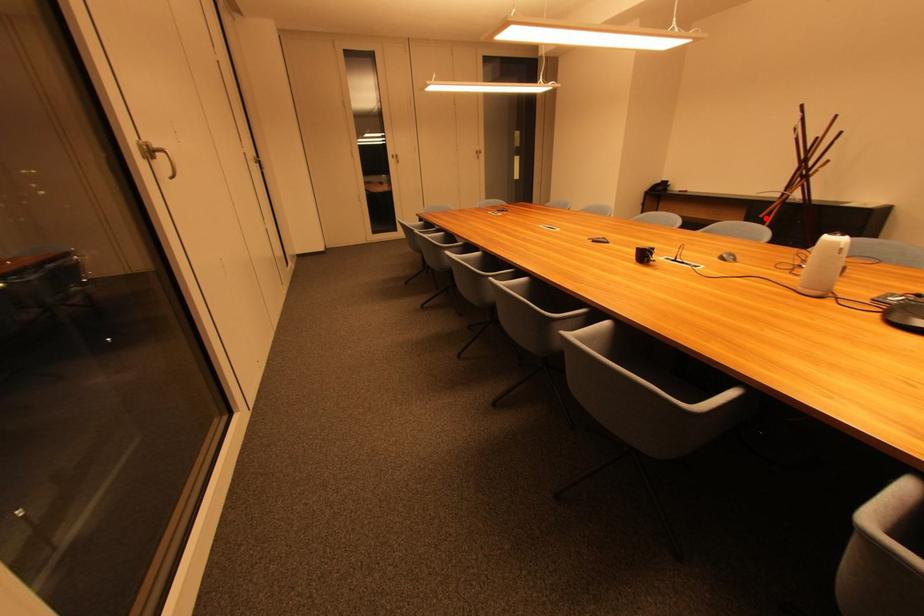
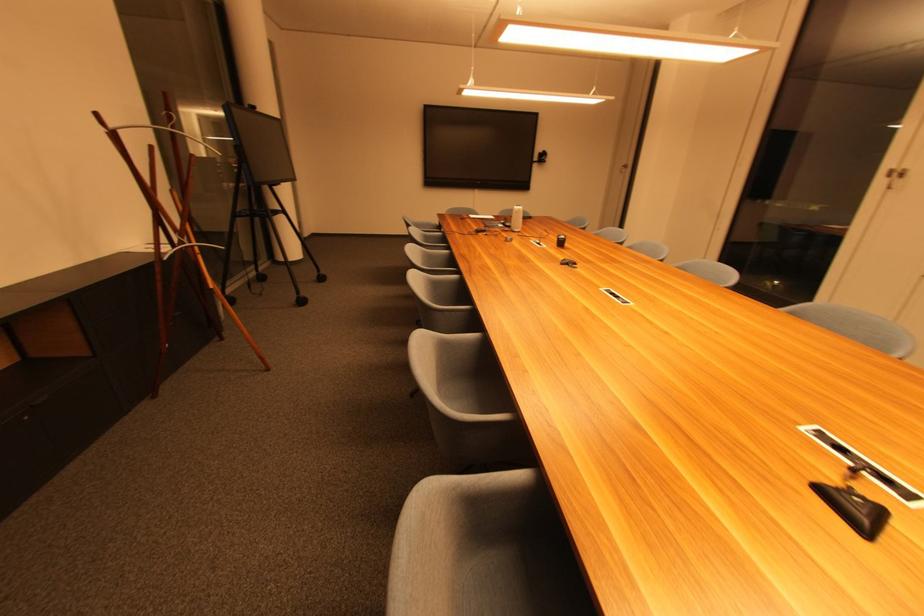
Question: A red point is marked in image1. In image2, is the corresponding 3D point closer to the camera or farther? Reply with the corresponding letter.

Choices:
 (A) The corresponding 3D point is closer.
 (B) The corresponding 3D point is farther.

Answer: (A)